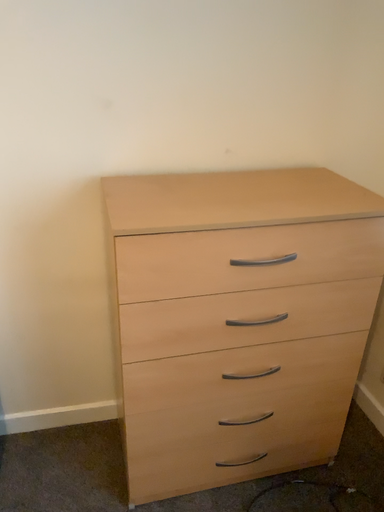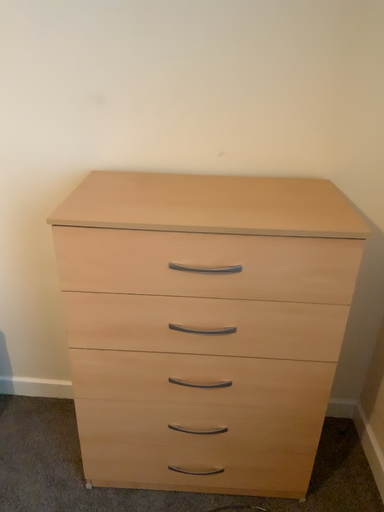
Question: How did the camera likely rotate when shooting the video?

Choices:
 (A) rotated right
 (B) rotated left

Answer: (B)